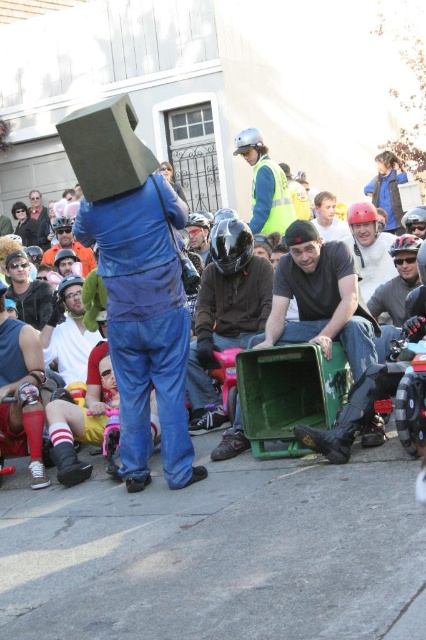
You are a participant in the street event and need to deliver a small package from the red socked leg at lower left to the reflective yellow vest at upper center. Can you walk directly to the destination without any obstacles?

The distance between the red socked leg at lower left and the reflective yellow vest at upper center is 11.71 meters. Assuming there are no obstacles in between, you can walk directly to the destination.

You are taking a photo of the lively outdoor scene. You notice two points marked in the image. Which point, point (350,586) or point (17,404), is closer to your camera lens?

Point (350,586) is closer to the camera lens than point (17,404).